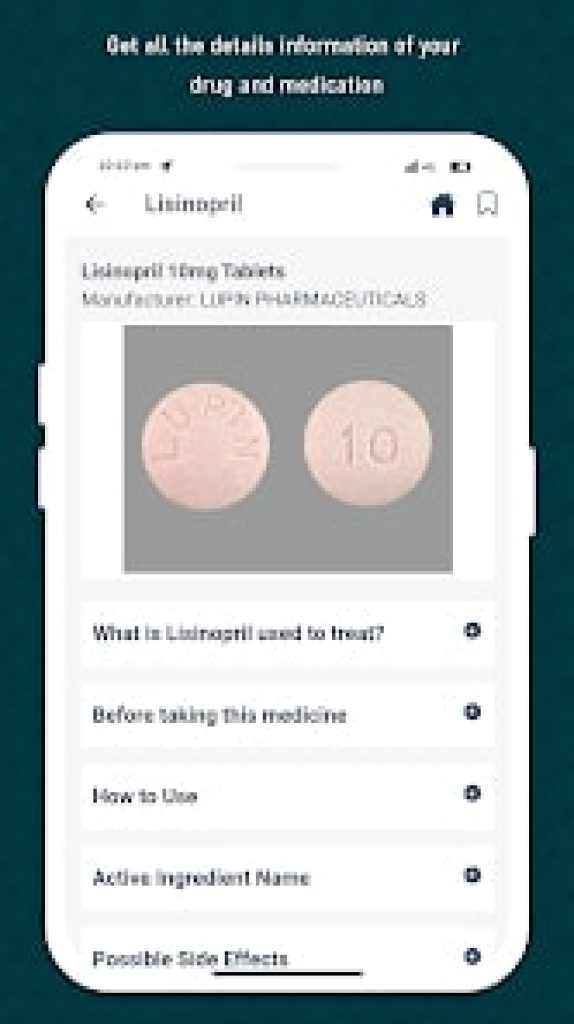
The height and width of the screenshot is (1024, 574). Identify the location of home bar. (350, 971).